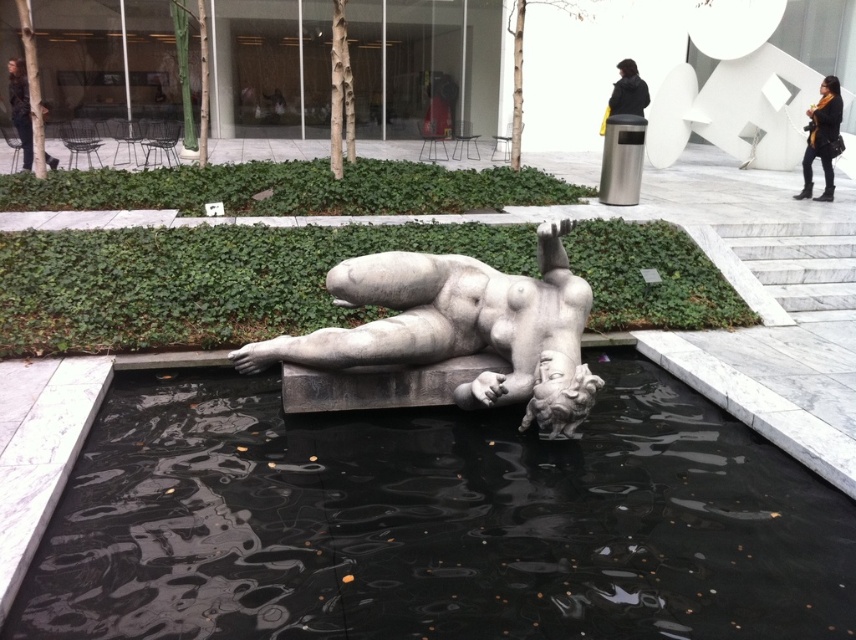
Question: Estimate the real-world distances between objects in this image. Which object is farther from the dark woolen coat at upper center?

Choices:
 (A) dark brown leather jacket at upper left
 (B) black polished water at center
 (C) white marble statue at center
 (D) yellow scarf at upper right

Answer: (A)

Question: In this image, where is yellow scarf at upper right located relative to dark woolen coat at upper center?

Choices:
 (A) above
 (B) below

Answer: (B)

Question: Which point appears closest to the camera in this image?

Choices:
 (A) (522, 307)
 (B) (827, 189)
 (C) (9, 60)

Answer: (A)

Question: Can you confirm if black polished water at center is positioned to the right of yellow scarf at upper right?

Choices:
 (A) no
 (B) yes

Answer: (A)

Question: Which point appears farthest from the camera in this image?

Choices:
 (A) (28, 99)
 (B) (360, 276)
 (C) (599, 625)
 (D) (823, 77)

Answer: (D)

Question: Does white marble statue at center have a lesser width compared to yellow scarf at upper right?

Choices:
 (A) yes
 (B) no

Answer: (B)